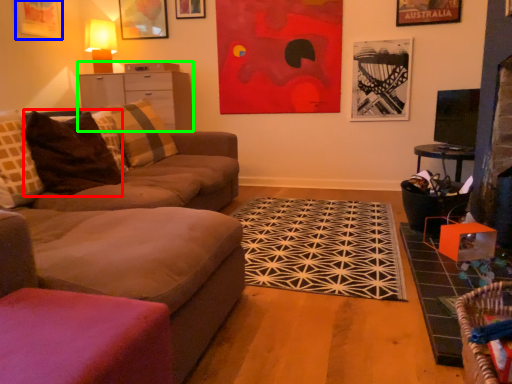
Question: Based on their relative distances, which object is farther from pillow (highlighted by a red box)? Choose from picture frame (highlighted by a blue box) and entertainment center (highlighted by a green box).

Choices:
 (A) picture frame
 (B) entertainment center

Answer: (A)